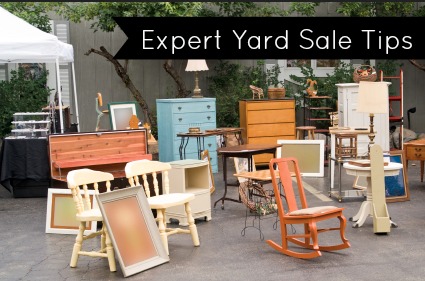
Identify the location of floor. This screenshot has width=425, height=281. (200, 261).